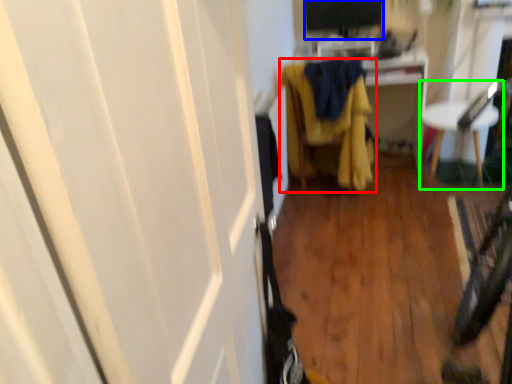
Question: Based on their relative distances, which object is farther from furniture (highlighted by a red box)? Choose from computer monitor (highlighted by a blue box) and furniture (highlighted by a green box).

Choices:
 (A) computer monitor
 (B) furniture

Answer: (A)